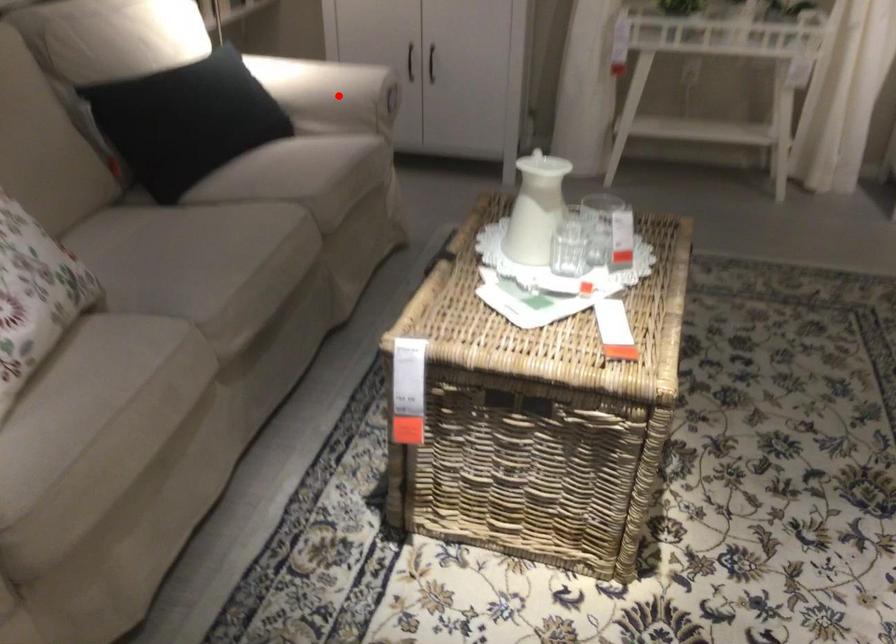
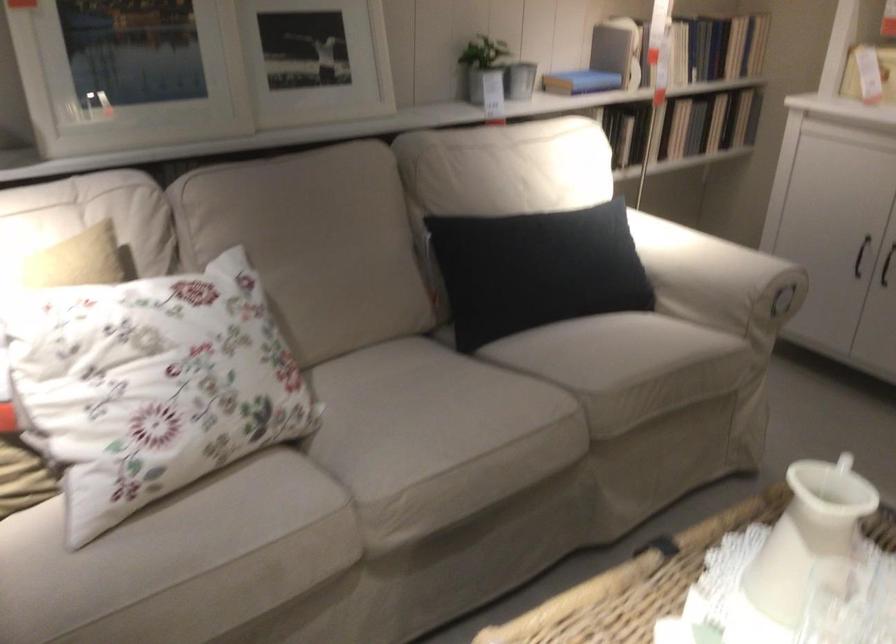
Question: I am providing you with two images of the same scene from different viewpoints. Given a red point in image1, look at the same physical point in image2. Is it:

Choices:
 (A) Closer to the viewpoint
 (B) Farther from the viewpoint

Answer: (A)